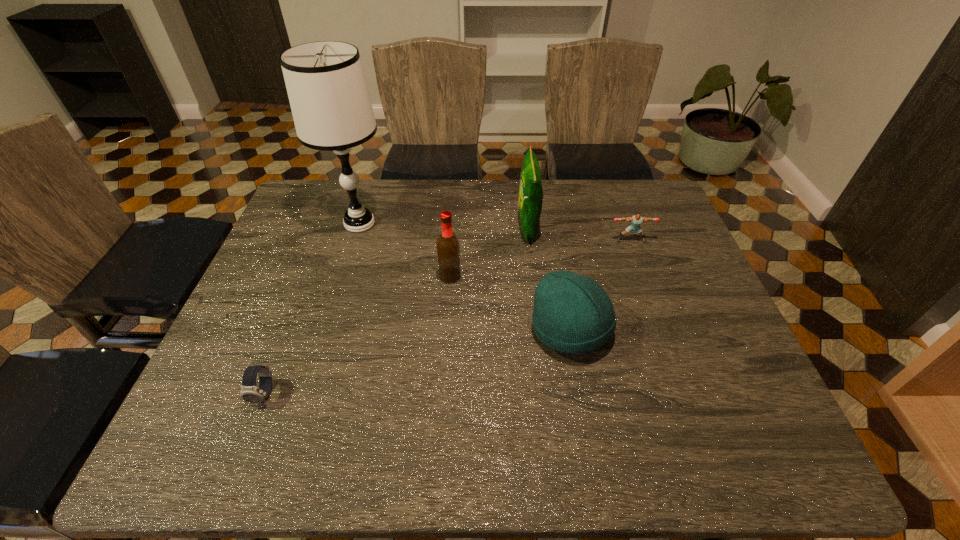
Locate an element on the screen. The height and width of the screenshot is (540, 960). free location located on the front-facing side of the crisp (potato chip) is located at coordinates (492, 228).

Where is `vacant position located 0.280m on the front-facing side of the crisp (potato chip)`? The height and width of the screenshot is (540, 960). vacant position located 0.280m on the front-facing side of the crisp (potato chip) is located at coordinates (426, 228).

You are a GUI agent. You are given a task and a screenshot of the screen. Output one action in this format:
    pyautogui.click(x=<x>, y=<y>)
    Task: Click on the free space located on the front-facing side of the crisp (potato chip)
    
    Given the screenshot: What is the action you would take?
    pyautogui.click(x=448, y=228)

Locate an element on the screen. The height and width of the screenshot is (540, 960). blank space located on the right of the third object from left to right is located at coordinates (582, 276).

You are a GUI agent. You are given a task and a screenshot of the screen. Output one action in this format:
    pyautogui.click(x=<x>, y=<y>)
    Task: Click on the vacant region located on the back of the fifth farthest object
    This screenshot has width=960, height=540.
    Given the screenshot: What is the action you would take?
    pyautogui.click(x=550, y=218)

What are the coordinates of `vacant area located 0.200m on the front-facing side of the puncher` in the screenshot? It's located at (650, 293).

In order to click on vacant space located 0.080m on the face of the nearest object in this screenshot , I will do `click(245, 446)`.

The width and height of the screenshot is (960, 540). I want to click on table lamp that is at the far edge, so click(x=328, y=94).

In order to click on crisp (potato chip) positioned at the far edge in this screenshot , I will do `click(530, 187)`.

Find the location of a particular element. The image size is (960, 540). table lamp present at the left edge is located at coordinates (328, 94).